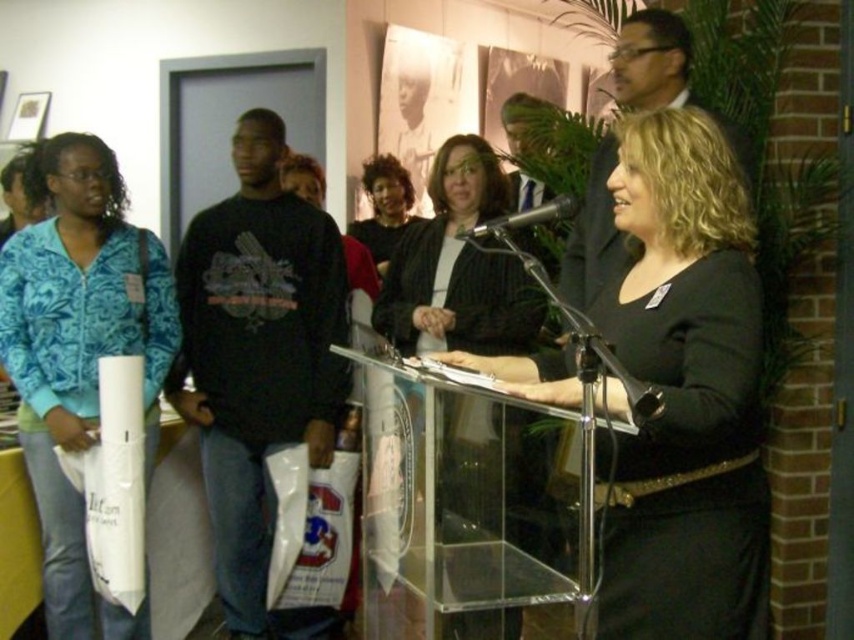
Question: Does blue patterned jacket at left appear over metallic silver microphone at center?

Choices:
 (A) no
 (B) yes

Answer: (A)

Question: Which point is farther from the camera taking this photo?

Choices:
 (A) (63, 173)
 (B) (465, 419)
 (C) (297, 358)

Answer: (C)

Question: Can you confirm if black cotton sweatshirt at left is thinner than matte black sweater at center?

Choices:
 (A) no
 (B) yes

Answer: (A)

Question: Which object is positioned closest to the matte black shirt at upper right?

Choices:
 (A) black glossy dress at center
 (B) black cotton sweatshirt at left
 (C) matte black podium at center
 (D) blue patterned jacket at left

Answer: (A)

Question: Which point appears farthest from the camera in this image?

Choices:
 (A) (506, 218)
 (B) (398, 209)
 (C) (635, 451)

Answer: (B)

Question: Does black glossy dress at center appear on the left side of black cotton sweatshirt at left?

Choices:
 (A) yes
 (B) no

Answer: (B)